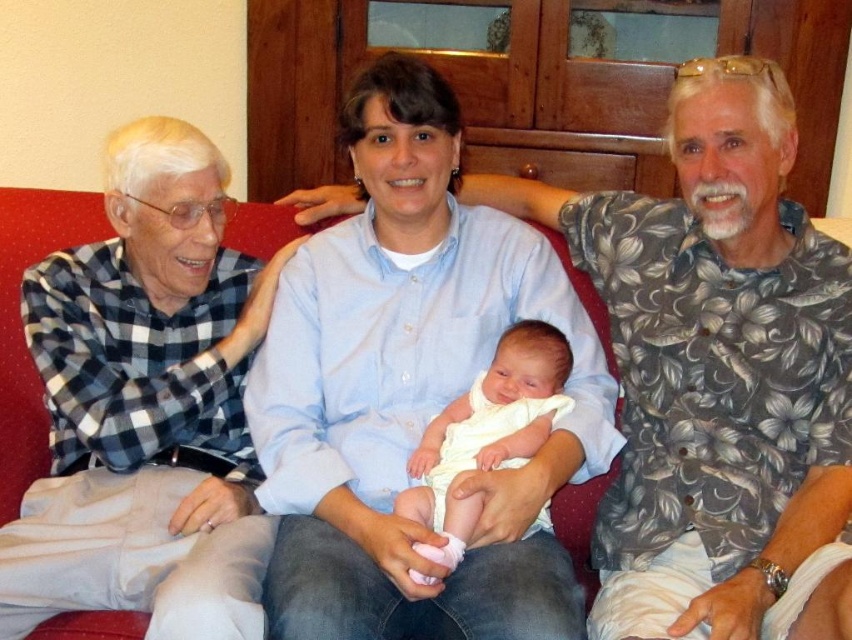
You are a photographer trying to capture a closeup of the checkered fabric shirt at left and the white clothed baby at center. Since you want to focus on both, which one should you adjust the camera focus for first?

The checkered fabric shirt at left is in front of the white clothed baby at center, so you should focus on the checkered fabric shirt at left first to ensure it is in clear view before adjusting for the baby.